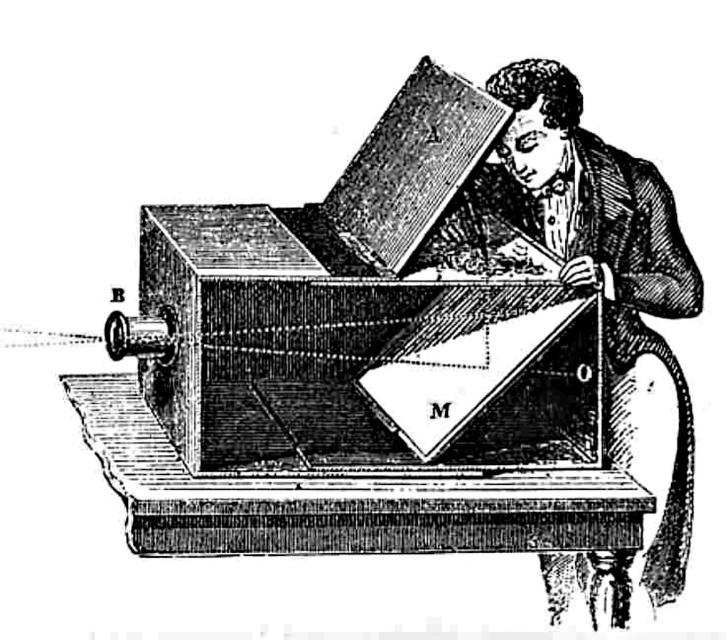
Is wooden piano at center smaller than wooden coat at upper right?

No.

Is wooden piano at center to the left of wooden coat at upper right from the viewer's perspective?

Yes, wooden piano at center is to the left of wooden coat at upper right.

Does point (448, 534) come in front of point (670, 305)?

That is True.

Locate an element on the screen. This screenshot has height=640, width=728. wooden piano at center is located at coordinates (360, 369).